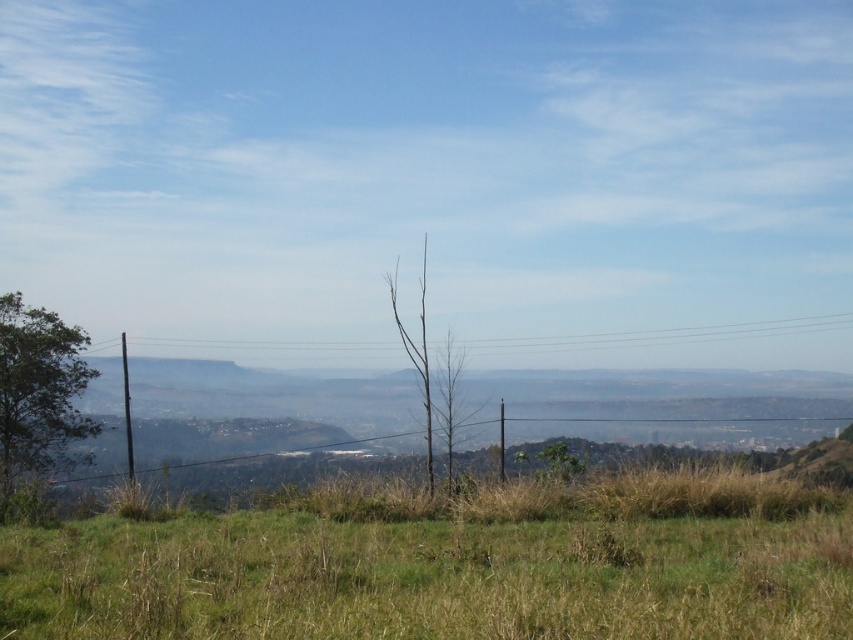
Can you confirm if green grass at lower center is bigger than green leafy tree at left?

No.

Locate an element on the screen. green grass at lower center is located at coordinates (454, 564).

Can you confirm if green leafy tree at left is bigger than bare wood tree at center?

Incorrect, green leafy tree at left is not larger than bare wood tree at center.

From the picture: Is green leafy tree at left thinner than bare wood tree at center?

No, green leafy tree at left is not thinner than bare wood tree at center.

What do you see at coordinates (38, 403) in the screenshot? This screenshot has width=853, height=640. I see `green leafy tree at left` at bounding box center [38, 403].

The width and height of the screenshot is (853, 640). What are the coordinates of `green leafy tree at left` in the screenshot? It's located at (38, 403).

Who is shorter, green grass at lower center or bare wood tree at center?

Standing shorter between the two is green grass at lower center.

In the scene shown: Does green grass at lower center have a greater height compared to bare wood tree at center?

In fact, green grass at lower center may be shorter than bare wood tree at center.

The width and height of the screenshot is (853, 640). What are the coordinates of `green grass at lower center` in the screenshot? It's located at tap(454, 564).